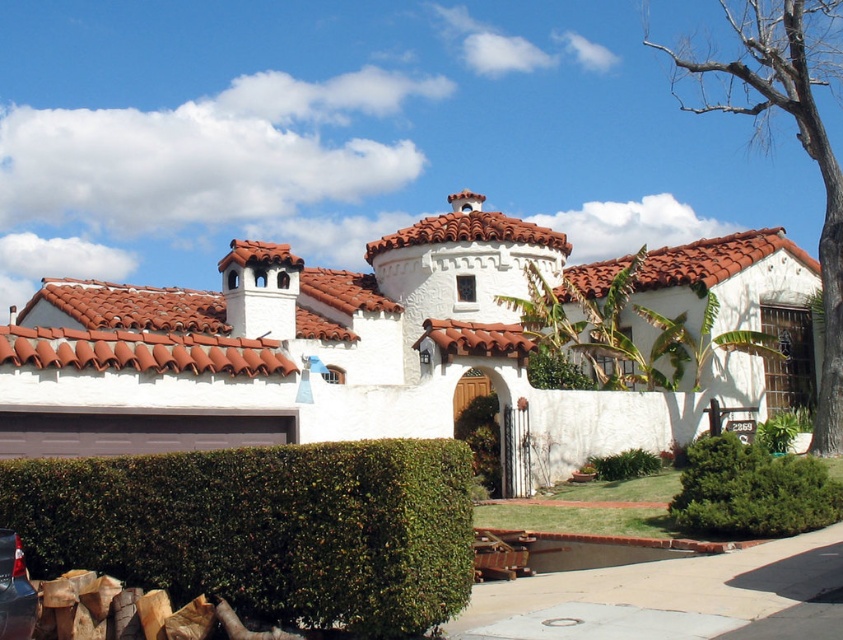
You are standing at the entrance of the Spanish house and want to take a photo that includes both the arched entryway and the green leafy hedge at lower left. Given that your camera has a maximum zoom range of 20 meters, will you be able to capture both in the same frame without moving closer?

The green leafy hedge at lower left is 22.96 meters away from the camera. Since the camera can only zoom up to 20 meters, you won taking a photo that includes both the arched entryway and the green leafy hedge at lower left without moving closer.

You are planning to plant a new hedge in your garden. You have a space that can accommodate a hedge up to the width of the terracotta tiles at center. Can the green leafy hedge at lower left fit in this space?

The green leafy hedge at lower left is thinner than the terracotta tiles at center, so it can fit in the space designed for the width of the terracotta tiles at center.